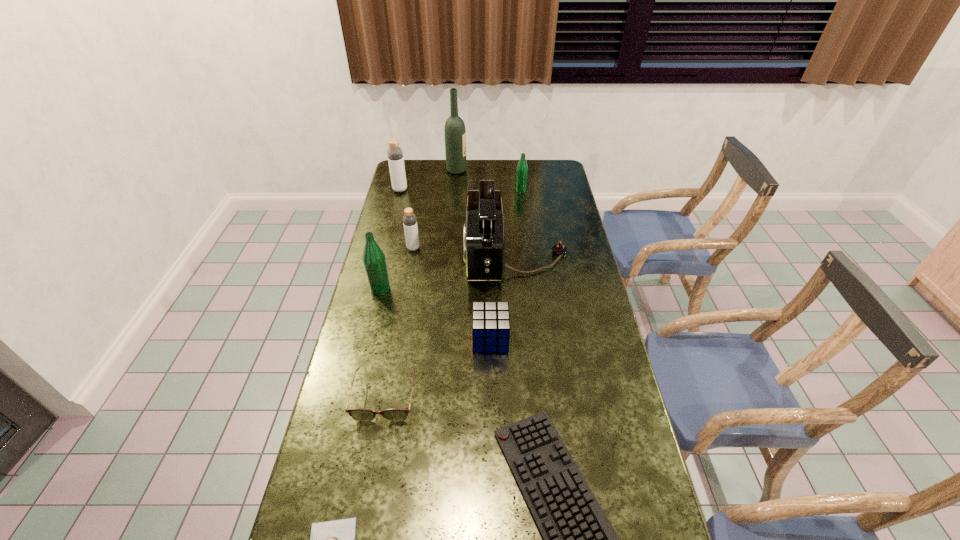
In order to click on blank area located on the right of the left green bottle in this screenshot , I will do `click(411, 289)`.

The image size is (960, 540). I want to click on free space located on the right of the rightmost bottle, so click(568, 191).

Find the location of a particular element. This screenshot has height=540, width=960. vacant space located on the right of the second nearest bottle is located at coordinates (469, 248).

Locate an element on the screen. The width and height of the screenshot is (960, 540). free space located on the back of the seventh tallest object is located at coordinates (489, 247).

Where is `free spot located 0.270m at the front view of the third shortest object`? This screenshot has height=540, width=960. free spot located 0.270m at the front view of the third shortest object is located at coordinates (360, 534).

Locate an element on the screen. object that is positioned at the far edge is located at coordinates (454, 131).

This screenshot has height=540, width=960. What are the coordinates of `spectacles located at the left edge` in the screenshot? It's located at (395, 414).

Locate an element on the screen. object that is positioned at the right edge is located at coordinates (483, 242).

The width and height of the screenshot is (960, 540). In order to click on blank space at the far edge of the desktop in this screenshot , I will do `click(438, 173)`.

In the image, there is a desktop. At what (x,y) coordinates should I click in order to perform the action: click on free space at the left edge. Please return your answer as a coordinate pair (x, y). Looking at the image, I should click on (427, 186).